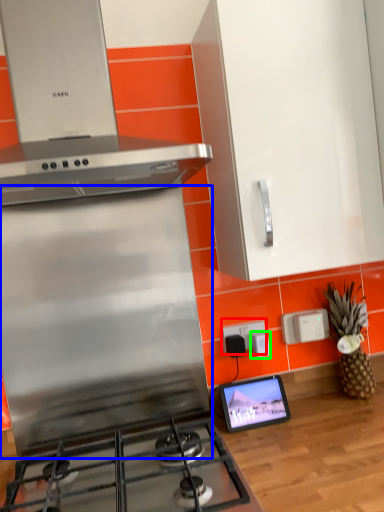
Question: Which object is positioned farthest from electric outlet (highlighted by a red box)? Select from kitchen appliance (highlighted by a blue box) and appliance (highlighted by a green box).

Choices:
 (A) kitchen appliance
 (B) appliance

Answer: (A)